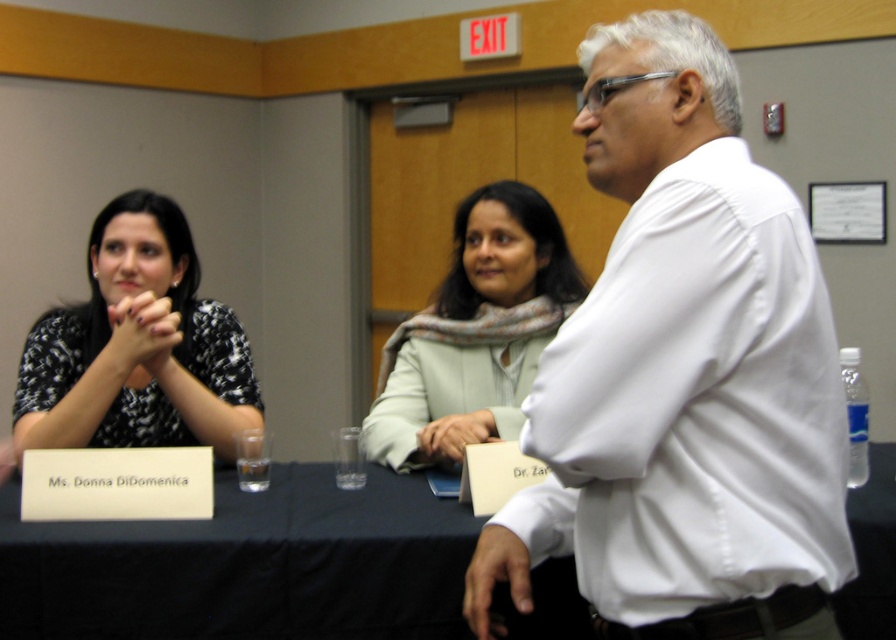
You are organizing a photo shoot and need to ensure that the black dotted dress at left and the matte black hands at center are visible in the frame. Based on their sizes, which object should you prioritize positioning closer to the camera to ensure clarity?

The black dotted dress at left might be wider than matte black hands at center, so you should prioritize positioning the black dotted dress at left closer to the camera to ensure clarity.

You are an event planner observing the panel discussion. You need to determine the relative positions of the black dotted dress at left and the matte black hands at center for seating arrangements. Which object is positioned higher in the image?

The black dotted dress at left is taller than the matte black hands at center, so the black dotted dress at left is positioned higher in the image.

You are an event planner arranging a photo shoot for the panel discussion. You need to ensure that the black dotted dress at left and the smooth beige hand at center are visible in the final shot. Based on their sizes, which object should be placed closer to the camera to maintain visibility?

The black dotted dress at left is taller than the smooth beige hand at center, so to maintain visibility for both, the smooth beige hand at center should be placed closer to the camera since it is smaller and might need to be emphasized.